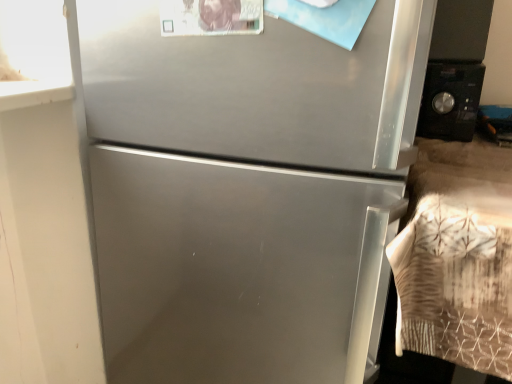
Question: Does point (346, 173) appear closer or farther from the camera than point (451, 127)?

Choices:
 (A) closer
 (B) farther

Answer: (A)

Question: Would you say satin silver refrigerator at center is to the left or to the right of black matte microwave at right in the picture?

Choices:
 (A) right
 (B) left

Answer: (B)

Question: Looking at the image, does satin silver refrigerator at center seem bigger or smaller compared to black matte microwave at right?

Choices:
 (A) big
 (B) small

Answer: (A)

Question: Considering the relative positions of black matte microwave at right and satin silver refrigerator at center in the image provided, is black matte microwave at right to the left or to the right of satin silver refrigerator at center?

Choices:
 (A) left
 (B) right

Answer: (B)

Question: Would you say black matte microwave at right is inside or outside satin silver refrigerator at center?

Choices:
 (A) outside
 (B) inside

Answer: (A)

Question: Considering the positions of point (483, 66) and point (126, 180), is point (483, 66) closer or farther from the camera than point (126, 180)?

Choices:
 (A) closer
 (B) farther

Answer: (B)

Question: In terms of width, does black matte microwave at right look wider or thinner when compared to satin silver refrigerator at center?

Choices:
 (A) thin
 (B) wide

Answer: (A)